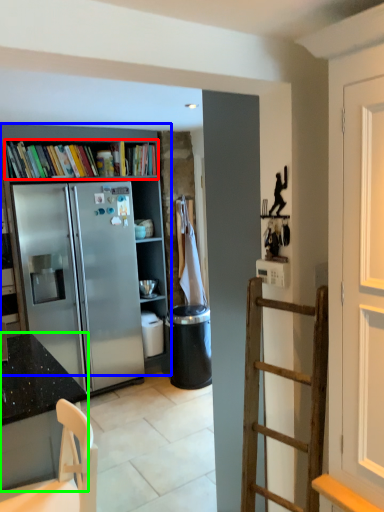
Question: Which object is the closest to the book (highlighted by a red box)? Choose among these: bookcase (highlighted by a blue box) or cabinetry (highlighted by a green box).

Choices:
 (A) bookcase
 (B) cabinetry

Answer: (A)